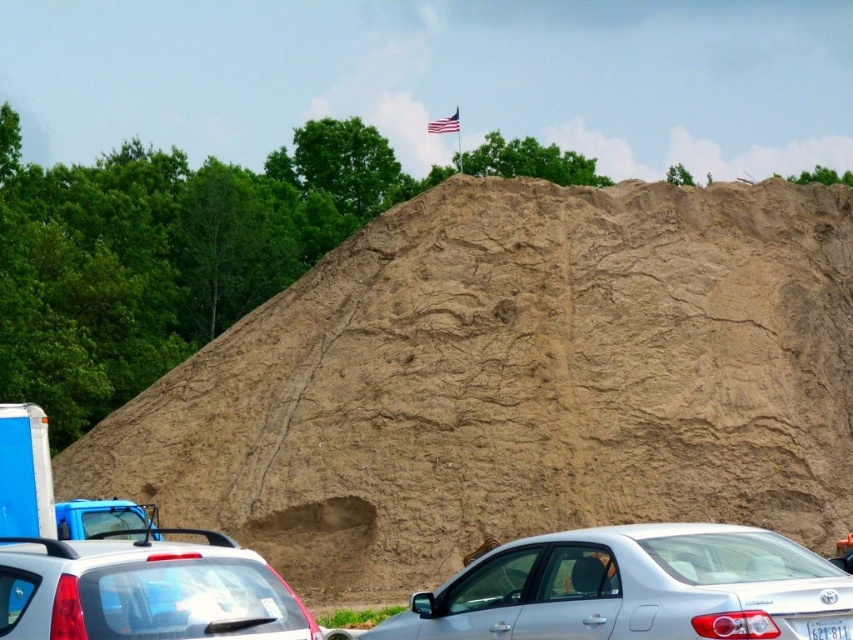
You are standing at the base of the mound and want to place a small flag exactly halfway between point [837,630] and point [456,120]. Which point is closer to the flagpole with the American flag?

Point [837,630] is closer to the flagpole with the American flag because it is in front of point [456,120], meaning it is closer to the observer and the flagpole located at the top of the mound.

You are a surveyor standing at the base of the mound and want to mark two points on the mound for a construction project. The points are labeled as point 1 at coordinate point (711, 579) and point 2 at coordinate point (434, 122). Which point is closer to your current position?

Point (711, 579) is closer to the camera than point (434, 122), so point 1 at coordinate point (711, 579) is closer to your current position.

You are a delivery driver who needs to park your truck, which is 6 feet tall, in this area. You see the satin silver sedan at center and the white matte hatchback at lower left. Which vehicle can you park behind without blocking the view of the American flag on the mound?

The white matte hatchback at lower left is shorter than the satin silver sedan at center. Since your truck is 6 feet tall, you should park behind the white matte hatchback at lower left to avoid blocking the view of the American flag.